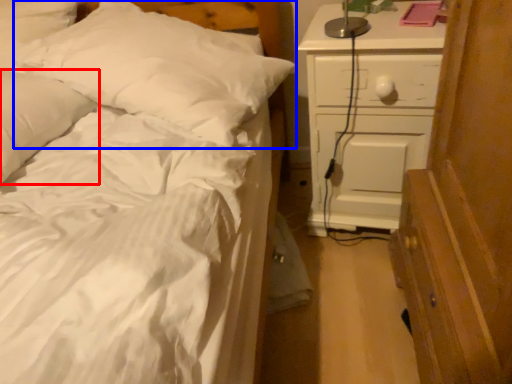
Question: Which object appears closest to the camera in this image, pillow (highlighted by a red box) or pillow (highlighted by a blue box)?

Choices:
 (A) pillow
 (B) pillow

Answer: (A)